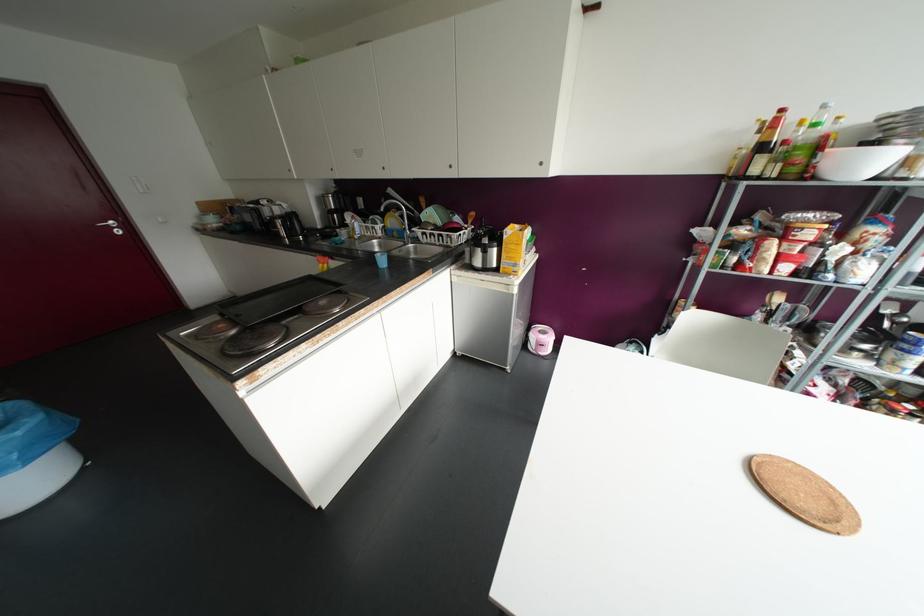
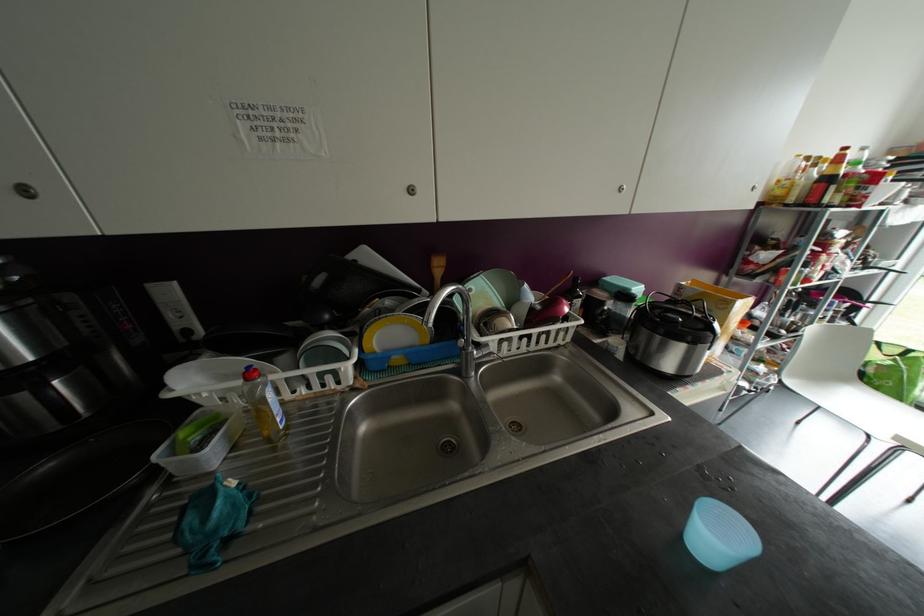
In the second image, find the point that corresponds to pixel 359 238 in the first image.

(286, 427)